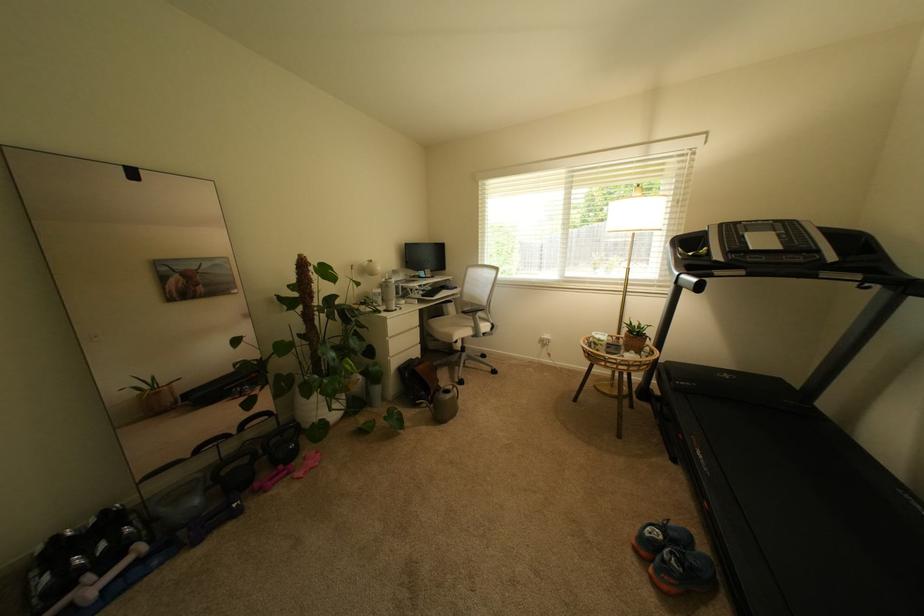
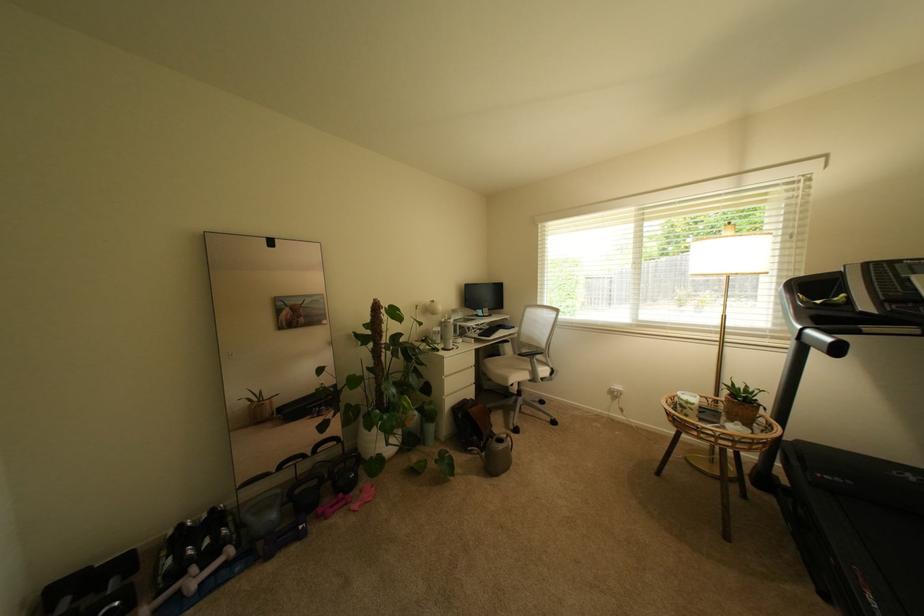
Locate, in the second image, the point that corresponds to the point at 695,294 in the first image.

(824, 355)